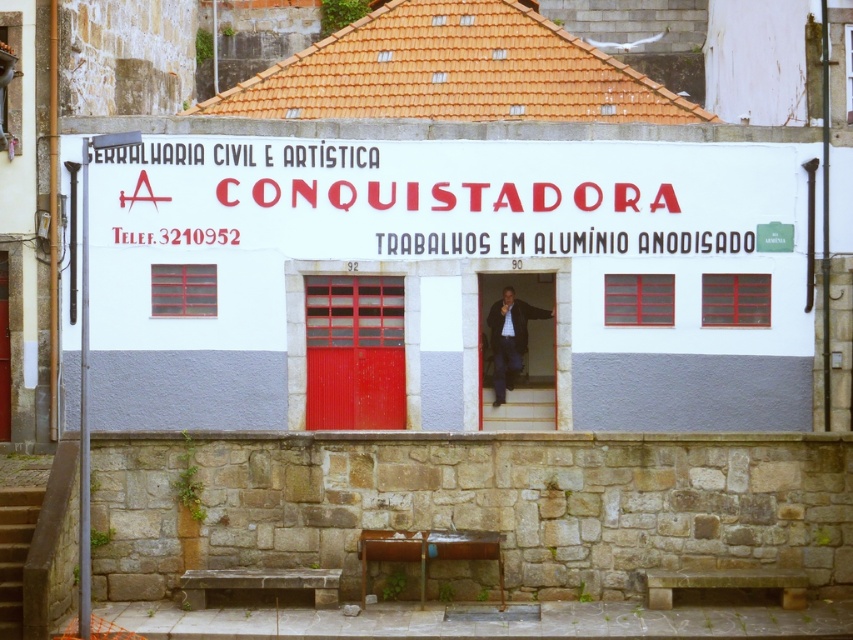
Question: From the image, what is the correct spatial relationship of metallic red door at center in relation to red painted wooden door at center?

Choices:
 (A) right
 (B) left

Answer: (B)

Question: Which point is farther from the camera taking this photo?

Choices:
 (A) (321, 380)
 (B) (524, 211)
 (C) (791, 209)

Answer: (A)

Question: In this image, where is white painted signboard at center located relative to red painted wooden door at center?

Choices:
 (A) above
 (B) below

Answer: (A)

Question: Which point is closer to the camera taking this photo?

Choices:
 (A) (322, 154)
 (B) (312, 332)

Answer: (A)

Question: Estimate the real-world distances between objects in this image. Which object is farther from the metallic red door at center?

Choices:
 (A) white painted wall at center
 (B) white painted signboard at center

Answer: (B)

Question: Does white painted wall at center have a smaller size compared to red painted wooden door at center?

Choices:
 (A) no
 (B) yes

Answer: (A)